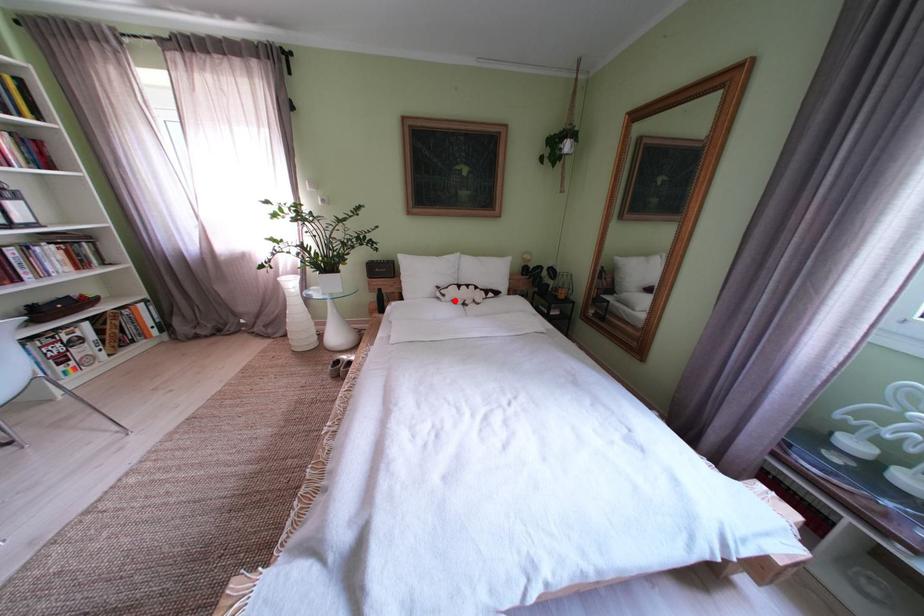
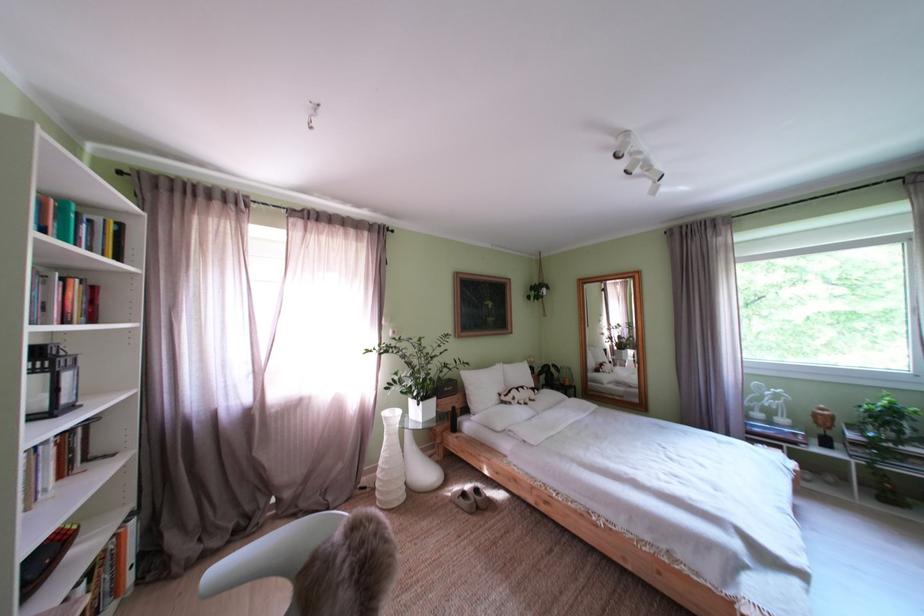
Question: I am providing you with two images of the same scene from different viewpoints. In image1, a red point is highlighted. Considering the same 3D point in image2, which of the following is correct?

Choices:
 (A) It is closer
 (B) It is farther

Answer: (B)